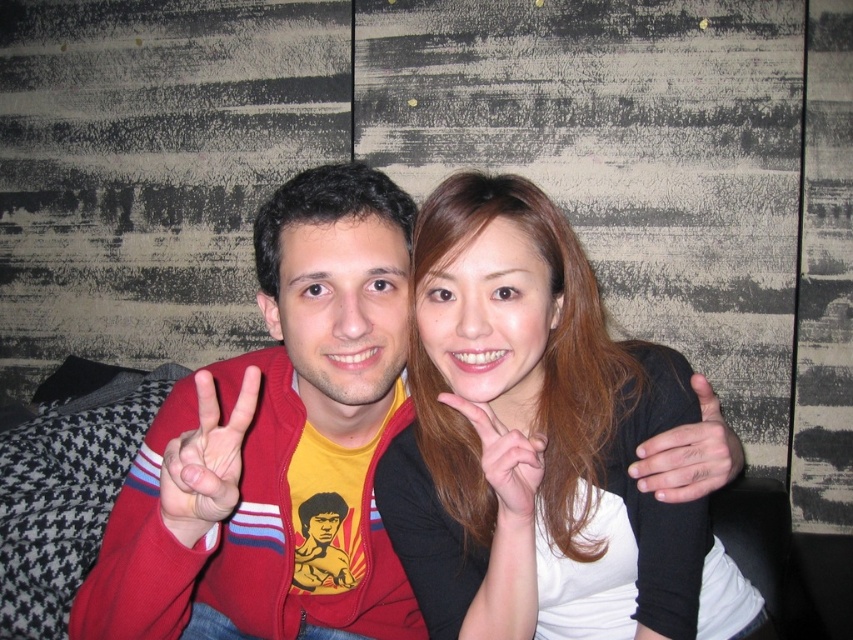
Question: Can you confirm if matte red jacket at center is positioned above matte red sweater at left?

Choices:
 (A) yes
 (B) no

Answer: (B)

Question: Among these points, which one is nearest to the camera?

Choices:
 (A) (521, 449)
 (B) (196, 516)
 (C) (663, 464)

Answer: (B)

Question: Which is nearer to the matte red sweater at left?

Choices:
 (A) matte black hand at center
 (B) matte red jacket at center
 (C) smooth brown hair at center
 (D) smooth skin hand at center

Answer: (B)

Question: Can you confirm if matte red sweater at left is wider than smooth skin hand at center?

Choices:
 (A) yes
 (B) no

Answer: (B)

Question: Can you confirm if matte red sweater at left is positioned to the left of matte black hand at center?

Choices:
 (A) yes
 (B) no

Answer: (A)

Question: Based on their relative distances, which object is farther from the matte red sweater at left?

Choices:
 (A) matte red jacket at center
 (B) smooth skin hand at center

Answer: (B)